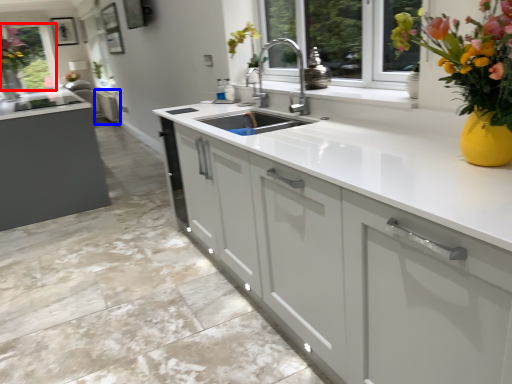
Question: Which object is further to the camera taking this photo, window screen (highlighted by a red box) or cabinetry (highlighted by a blue box)?

Choices:
 (A) window screen
 (B) cabinetry

Answer: (B)